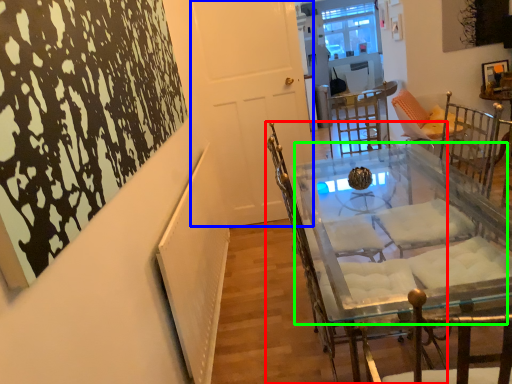
Question: Which object is the closest to the chair (highlighted by a red box)? Choose among these: door (highlighted by a blue box) or round table (highlighted by a green box).

Choices:
 (A) door
 (B) round table

Answer: (B)